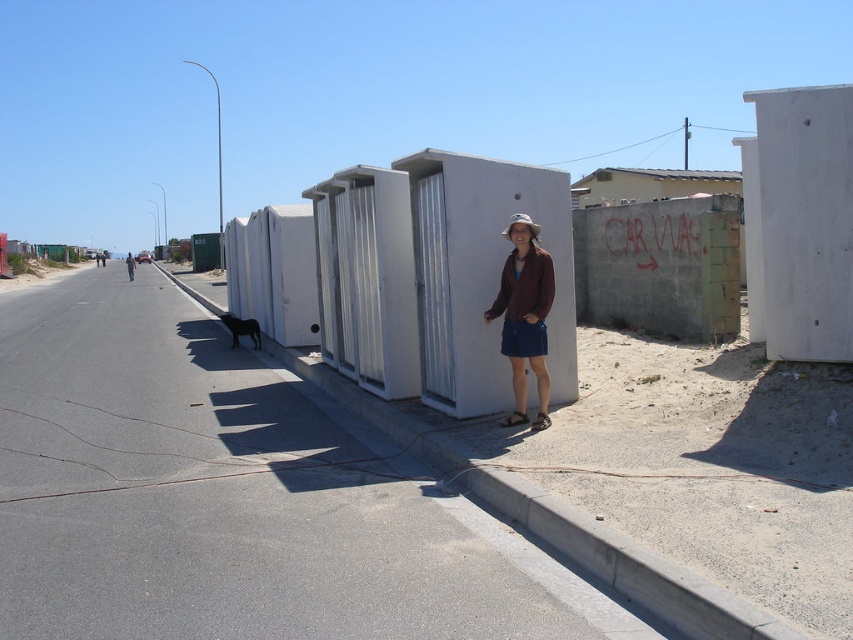
Question: Which of the following is the farthest from the observer?

Choices:
 (A) (685, 184)
 (B) (544, 378)
 (C) (131, 260)
 (D) (805, 154)

Answer: (C)

Question: Does white concrete wall at upper right appear under matte brown jacket at center?

Choices:
 (A) yes
 (B) no

Answer: (B)

Question: Is white concrete hut at center positioned before matte brown jacket at center?

Choices:
 (A) yes
 (B) no

Answer: (B)

Question: Estimate the real-world distances between objects in this image. Which object is closer to the metallic corrugated roof at upper center?

Choices:
 (A) white concrete wall at upper right
 (B) matte brown jacket at center
 (C) white concrete hut at center
 (D) brown leather jacket at center

Answer: (B)

Question: Can you confirm if matte brown jacket at center is positioned to the left of metallic corrugated roof at upper center?

Choices:
 (A) no
 (B) yes

Answer: (B)

Question: Among these objects, which one is farthest from the camera?

Choices:
 (A) matte brown jacket at center
 (B) metallic corrugated roof at upper center
 (C) white concrete wall at upper right

Answer: (B)